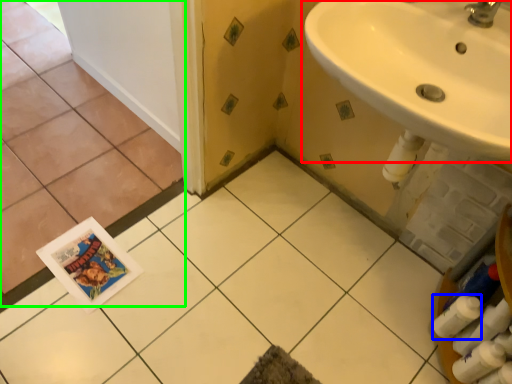
Question: Estimate the real-world distances between objects in this image. Which object is closer to sink (highlighted by a red box), toilet paper (highlighted by a blue box) or ceramic tile (highlighted by a green box)?

Choices:
 (A) toilet paper
 (B) ceramic tile

Answer: (A)